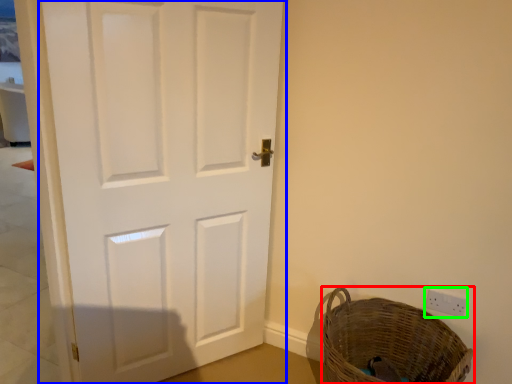
Question: Estimate the real-world distances between objects in this image. Which object is farther from basket (highlighted by a red box), door (highlighted by a blue box) or electric outlet (highlighted by a green box)?

Choices:
 (A) door
 (B) electric outlet

Answer: (A)